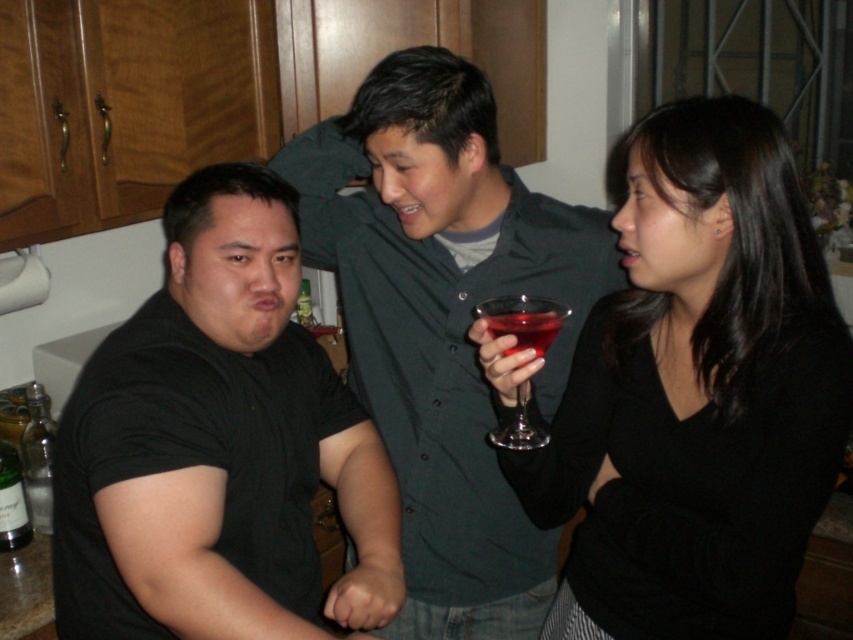
Question: Can you confirm if black matte dress at center is positioned to the left of translucent glass at center?

Choices:
 (A) yes
 (B) no

Answer: (B)

Question: Which of these objects is positioned closest to the translucent glass wine glass at center?

Choices:
 (A) matte gray shirt at center
 (B) black matte dress at center
 (C) translucent glass at center

Answer: (C)

Question: Which point is closer to the camera?

Choices:
 (A) translucent glass at center
 (B) translucent glass wine glass at center
 (C) black matte dress at center
 (D) black matte shirt at left

Answer: (D)

Question: Among these objects, which one is farthest from the camera?

Choices:
 (A) translucent glass at center
 (B) black matte dress at center

Answer: (B)

Question: Does black matte shirt at left appear under translucent glass at center?

Choices:
 (A) yes
 (B) no

Answer: (A)

Question: In this image, where is matte gray shirt at center located relative to translucent glass at center?

Choices:
 (A) left
 (B) right

Answer: (A)